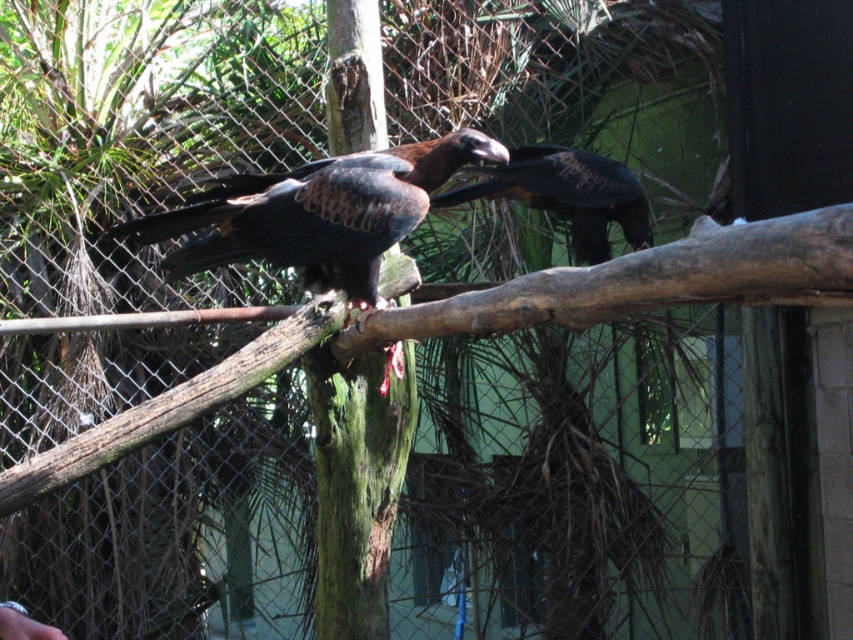
Is point (788, 269) behind point (251, 188)?

That is False.

Is point (704, 220) positioned before point (351, 179)?

Yes, it is.

Based on the photo, who is more distant from viewer, (827, 268) or (341, 170)?

Point (341, 170)

Where is `brown rough wood at center`? The image size is (853, 640). brown rough wood at center is located at coordinates (491, 323).

Between dark brown feathers at center and shiny dark brown eagle at center, which one is positioned lower?

dark brown feathers at center is below.

Can you confirm if dark brown feathers at center is positioned below shiny dark brown eagle at center?

Indeed, dark brown feathers at center is positioned under shiny dark brown eagle at center.

You are a GUI agent. You are given a task and a screenshot of the screen. Output one action in this format:
    pyautogui.click(x=<x>, y=<y>)
    Task: Click on the dark brown feathers at center
    This screenshot has width=853, height=640.
    Given the screenshot: What is the action you would take?
    pyautogui.click(x=316, y=212)

At what (x,y) coordinates should I click in order to perform the action: click on dark brown feathers at center. Please return your answer as a coordinate pair (x, y). Looking at the image, I should click on (316, 212).

Which of these two, brown rough wood at center or shiny dark brown eagle at center, stands shorter?

With less height is shiny dark brown eagle at center.

Can you confirm if brown rough wood at center is positioned to the right of shiny dark brown eagle at center?

No, brown rough wood at center is not to the right of shiny dark brown eagle at center.

Is point (264, 342) positioned in front of point (587, 262)?

Yes, point (264, 342) is in front of point (587, 262).

Where is `brown rough wood at center`? brown rough wood at center is located at coordinates (491, 323).